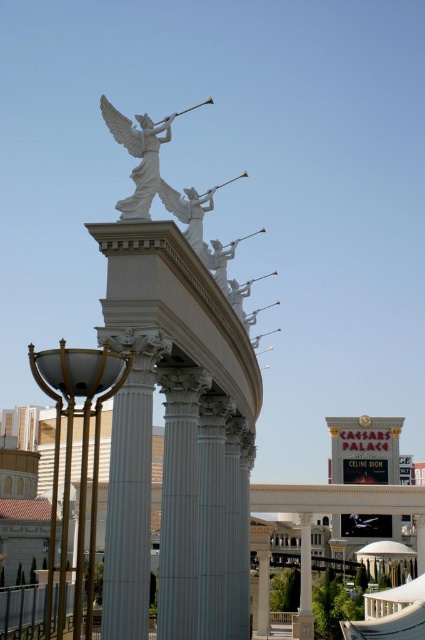
Question: Does gold polished metal lamp post at lower left have a smaller size compared to white marble angel at upper center?

Choices:
 (A) yes
 (B) no

Answer: (B)

Question: Where is gold polished metal lamp post at lower left located in relation to white marble angel at upper center in the image?

Choices:
 (A) below
 (B) above

Answer: (A)

Question: Which point is farther from the camera taking this photo?

Choices:
 (A) (138, 218)
 (B) (121, 372)

Answer: (A)

Question: Is gold polished metal lamp post at lower left further to camera compared to white marble angel at upper center?

Choices:
 (A) no
 (B) yes

Answer: (A)